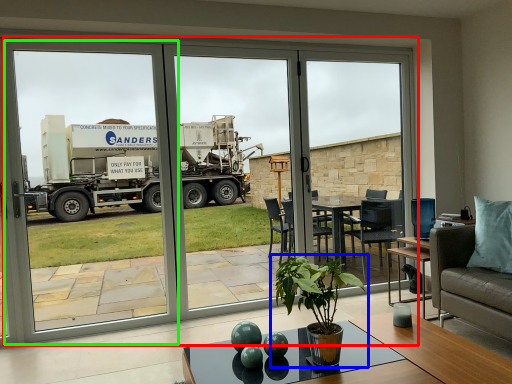
Question: Based on their relative distances, which object is nearer to door (highlighted by a red box)? Choose from houseplant (highlighted by a blue box) and screen door (highlighted by a green box).

Choices:
 (A) houseplant
 (B) screen door

Answer: (A)